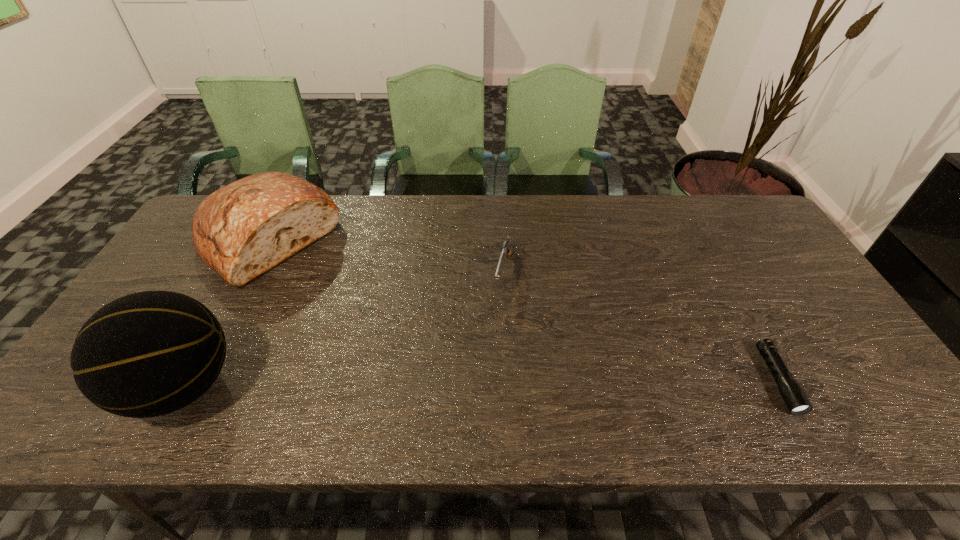
This screenshot has width=960, height=540. I want to click on free space on the desktop that is between the tallest object and the rightmost object and is positioned at the sliced front of the bread, so click(x=424, y=383).

Locate an element on the screen. The height and width of the screenshot is (540, 960). vacant spot on the desktop that is between the basketball and the shortest object and is positioned aiming along the barrel of the second shortest object is located at coordinates (473, 383).